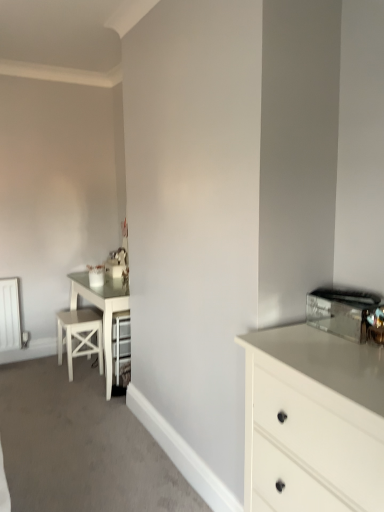
Where is `vacant space situated above white wood bar stool at left (from a real-world perspective)`? This screenshot has height=512, width=384. vacant space situated above white wood bar stool at left (from a real-world perspective) is located at coordinates (74, 315).